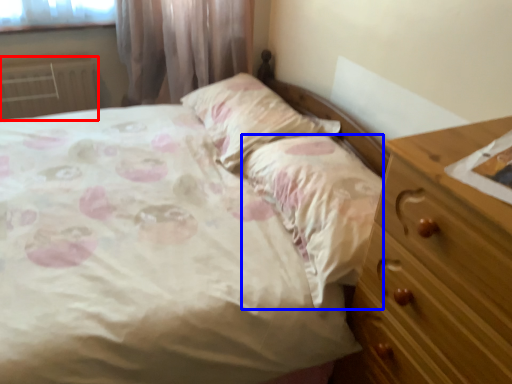
Question: Among these objects, which one is farthest to the camera, radiator (highlighted by a red box) or sheet (highlighted by a blue box)?

Choices:
 (A) radiator
 (B) sheet

Answer: (A)